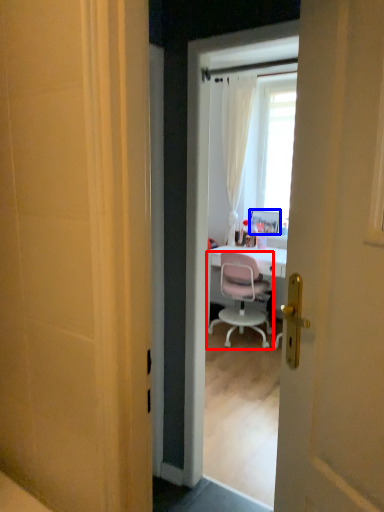
Question: Which object is further to the camera taking this photo, chair (highlighted by a red box) or picture frame (highlighted by a blue box)?

Choices:
 (A) chair
 (B) picture frame

Answer: (B)